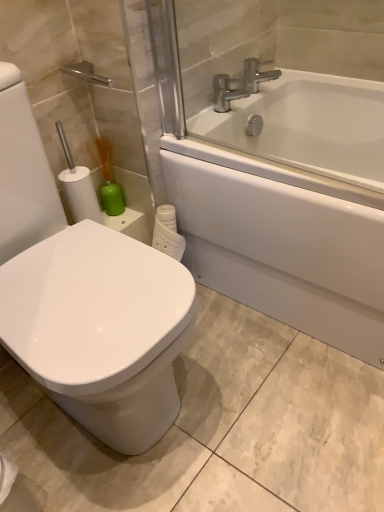
Question: From a real-world perspective, relative to white glossy bathtub at upper right, is green matte soap dispenser at left vertically above or below?

Choices:
 (A) above
 (B) below

Answer: (A)

Question: Considering the positions of green matte soap dispenser at left and white glossy bathtub at upper right in the image, is green matte soap dispenser at left wider or thinner than white glossy bathtub at upper right?

Choices:
 (A) wide
 (B) thin

Answer: (B)

Question: Which object is positioned closest to the silver metallic faucet at upper center?

Choices:
 (A) silver metallic faucet at upper center
 (B) white glossy bidet at left
 (C) green matte soap dispenser at left
 (D) white glossy bathtub at upper right

Answer: (A)

Question: Which object is positioned farthest from the silver metallic faucet at upper center?

Choices:
 (A) white glossy bidet at left
 (B) green matte soap dispenser at left
 (C) silver metallic faucet at upper center
 (D) white glossy bathtub at upper right

Answer: (A)